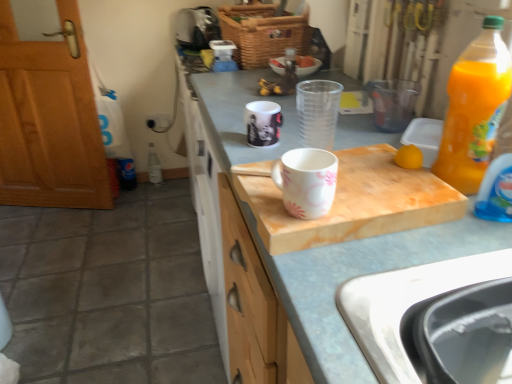
Find the location of a particular element. The width and height of the screenshot is (512, 384). free space to the right of white glossy mug at center, which ranks as the 2th coffee cup in back-to-front order is located at coordinates (379, 187).